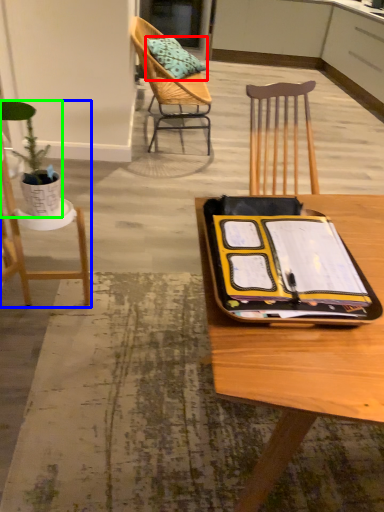
Question: Estimate the real-world distances between objects in this image. Which object is farther from pillow (highlighted by a red box), chair (highlighted by a blue box) or houseplant (highlighted by a green box)?

Choices:
 (A) chair
 (B) houseplant

Answer: (B)